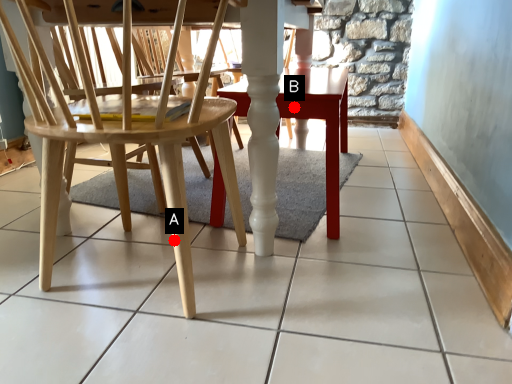
Question: Two points are circled on the image, labeled by A and B beside each circle. Which point appears closest to the camera in this image?

Choices:
 (A) A is closer
 (B) B is closer

Answer: (A)